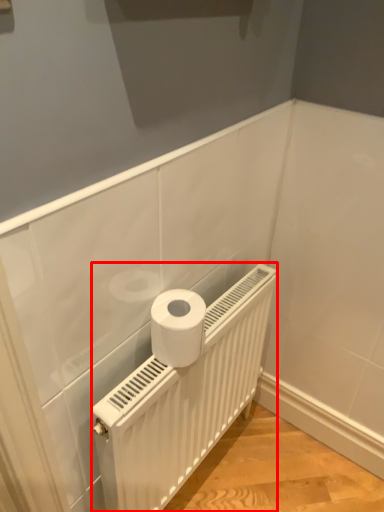
Question: From the image's perspective, what is the correct spatial positioning of radiator (annotated by the red box) in reference to toilet paper?

Choices:
 (A) below
 (B) above

Answer: (A)